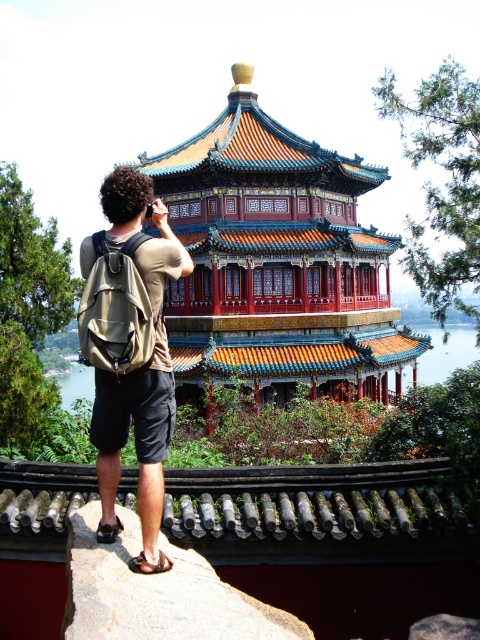
Can you confirm if shiny lacquered pavilion at center is wider than khaki fabric backpack at center?

Yes, shiny lacquered pavilion at center is wider than khaki fabric backpack at center.

Does point (202, 349) lie behind point (153, 250)?

Yes, point (202, 349) is behind point (153, 250).

Measure the distance between point (x=391, y=356) and camera.

A distance of 42.97 meters exists between point (x=391, y=356) and camera.

The height and width of the screenshot is (640, 480). Find the location of `shiny lacquered pavilion at center`. shiny lacquered pavilion at center is located at coordinates (276, 262).